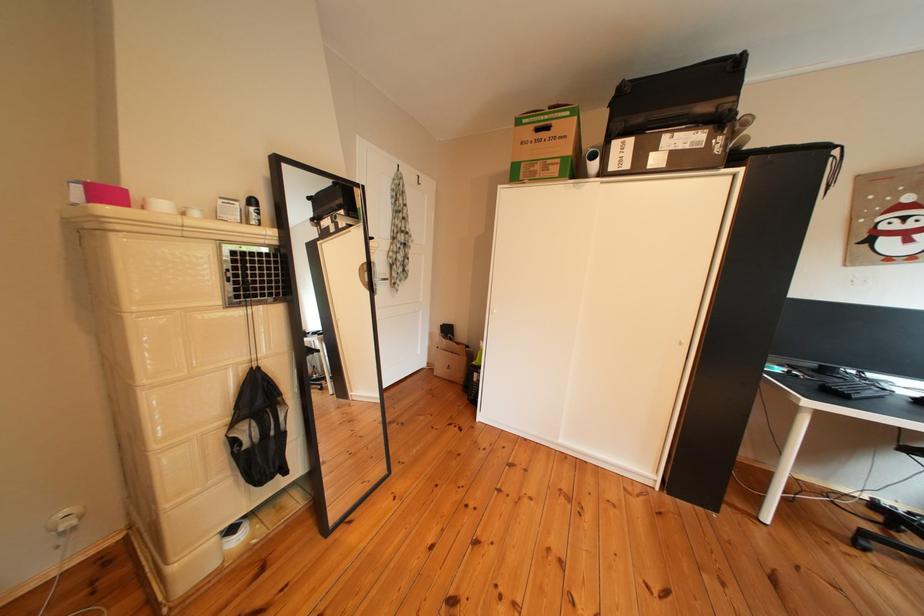
Locate an element on the screen. This screenshot has width=924, height=616. metallic door handle is located at coordinates (385, 277).